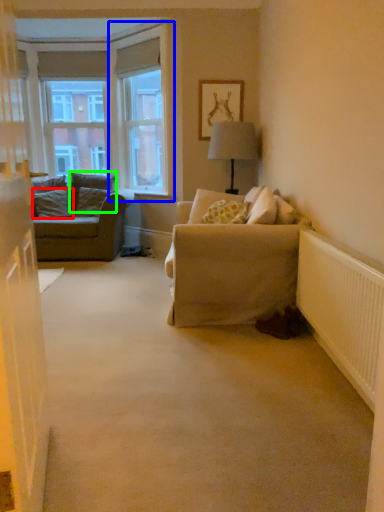
Question: Which is farther away from pillow (highlighted by a red box)? window frame (highlighted by a blue box) or pillow (highlighted by a green box)?

Choices:
 (A) window frame
 (B) pillow

Answer: (A)